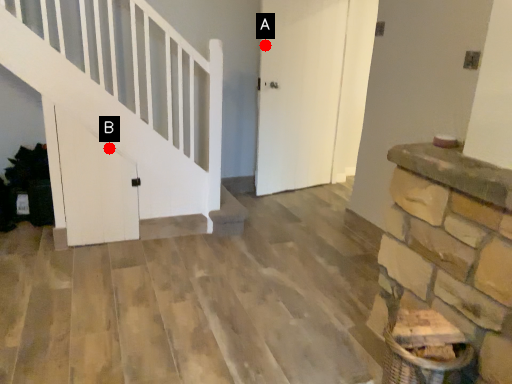
Question: Two points are circled on the image, labeled by A and B beside each circle. Which point is further to the camera?

Choices:
 (A) A is further
 (B) B is further

Answer: (A)